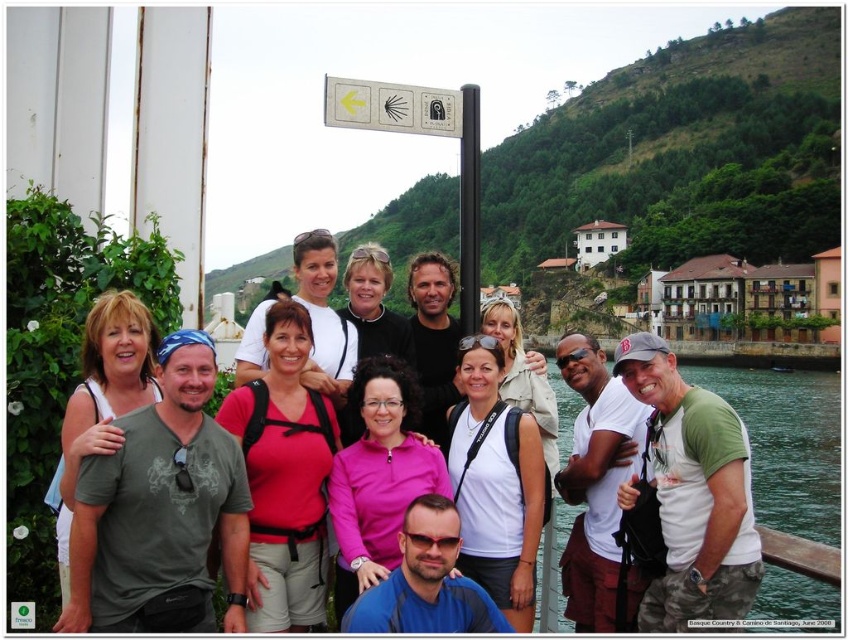
Does white plastic sign at upper center have a greater width compared to black metal pole at center?

Yes, white plastic sign at upper center is wider than black metal pole at center.

Find the location of a particular element. The width and height of the screenshot is (848, 640). white plastic sign at upper center is located at coordinates (391, 108).

Between point (444, 97) and point (478, 170), which one is positioned behind?

The point (444, 97) is behind.

At what (x,y) coordinates should I click in order to perform the action: click on white plastic sign at upper center. Please return your answer as a coordinate pair (x, y). This screenshot has width=848, height=640. Looking at the image, I should click on (391, 108).

Does transparent water at lower right appear on the right side of white plastic sign at upper center?

Indeed, transparent water at lower right is positioned on the right side of white plastic sign at upper center.

Describe the element at coordinates (788, 444) in the screenshot. The height and width of the screenshot is (640, 848). I see `transparent water at lower right` at that location.

Which is in front, point (799, 472) or point (389, 102)?

Positioned in front is point (389, 102).

Where is `transparent water at lower right`? Image resolution: width=848 pixels, height=640 pixels. transparent water at lower right is located at coordinates (788, 444).

Is point (798, 376) more distant than point (469, 237)?

Yes, it is.

Is point (809, 595) more distant than point (475, 221)?

Yes, point (809, 595) is behind point (475, 221).

Image resolution: width=848 pixels, height=640 pixels. In order to click on transparent water at lower right in this screenshot , I will do `click(788, 444)`.